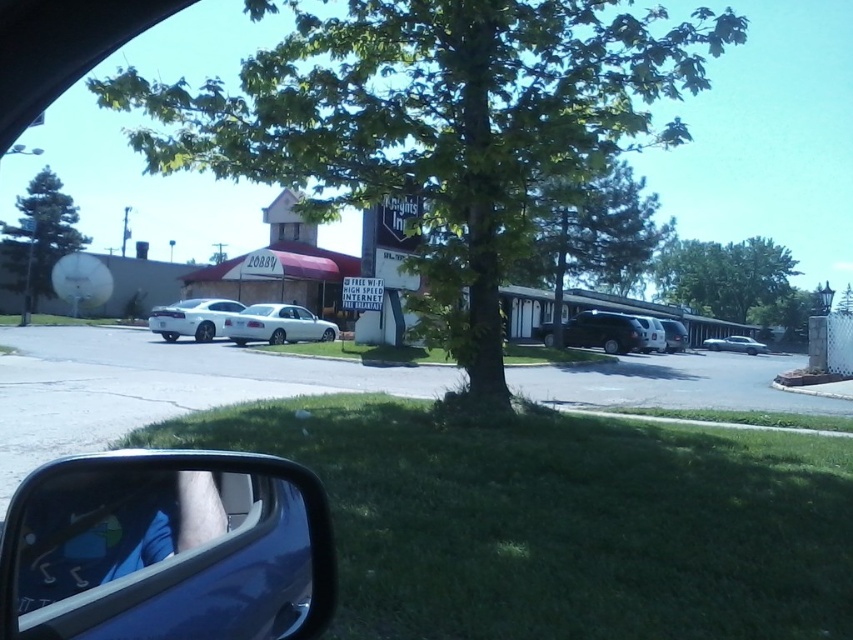
You are sitting in the driver seat of the car and want to check two points on the windshield. The first point is at coordinates point [293,339] and the second is at point [195,324]. Which point is closer to you?

Point [195,324] is closer to you because it is in front of point [293,339].

You are a photographer trying to capture a reflection of the motel complex in the glossy plastic side mirror at lower left. Given that the mirror is 30.75 inches away from the camera, is it positioned within the typical focal range of a standard camera lens to capture clear reflections?

The glossy plastic side mirror at lower left is 30.75 inches away from the camera, which is within the typical focal range of a standard camera lens. Therefore, it should be possible to capture a clear reflection of the motel complex in the mirror.

You are a photographer trying to capture a photo of the motel complex. You notice the green leafy tree at center and the satin black suv at center in your shot. Which object would block more of the background motel complex if placed closer to the camera?

The green leafy tree at center is much taller than the satin black suv at center, so it would block more of the background motel complex if placed closer to the camera.